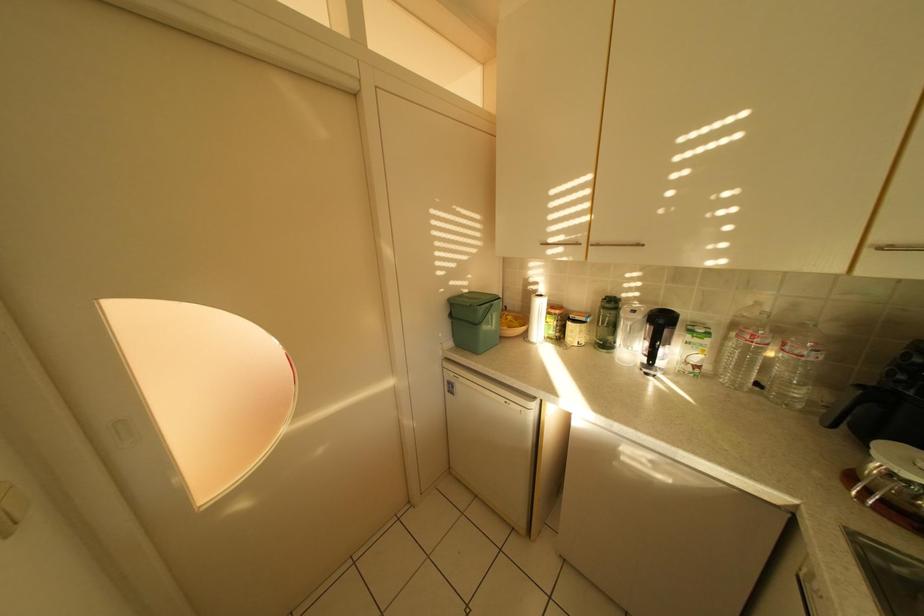
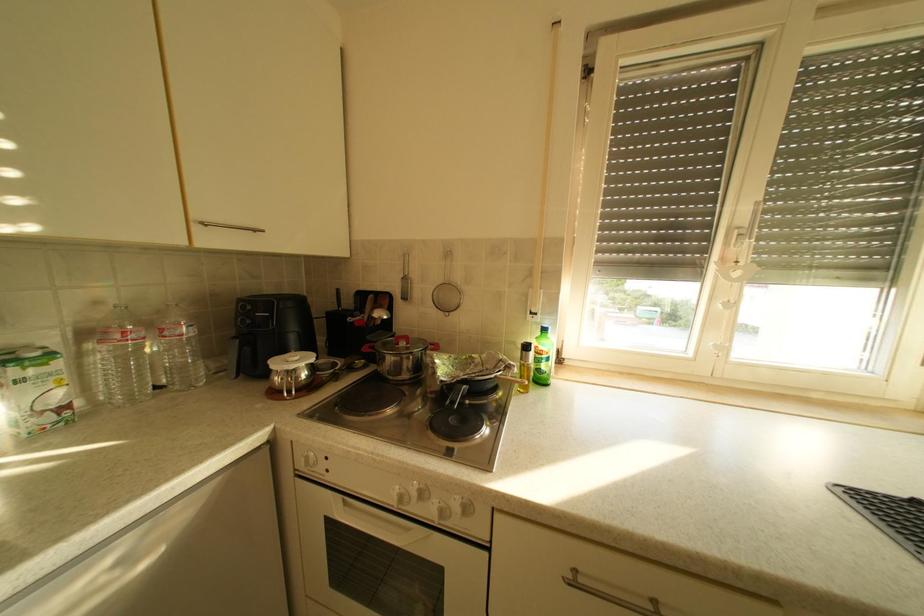
Question: The camera is either moving clockwise (left) or counter-clockwise (right) around the object. The first image is from the beginning of the video and the second image is from the end. Is the camera moving left or right when shooting the video?

Choices:
 (A) Left
 (B) Right

Answer: (A)